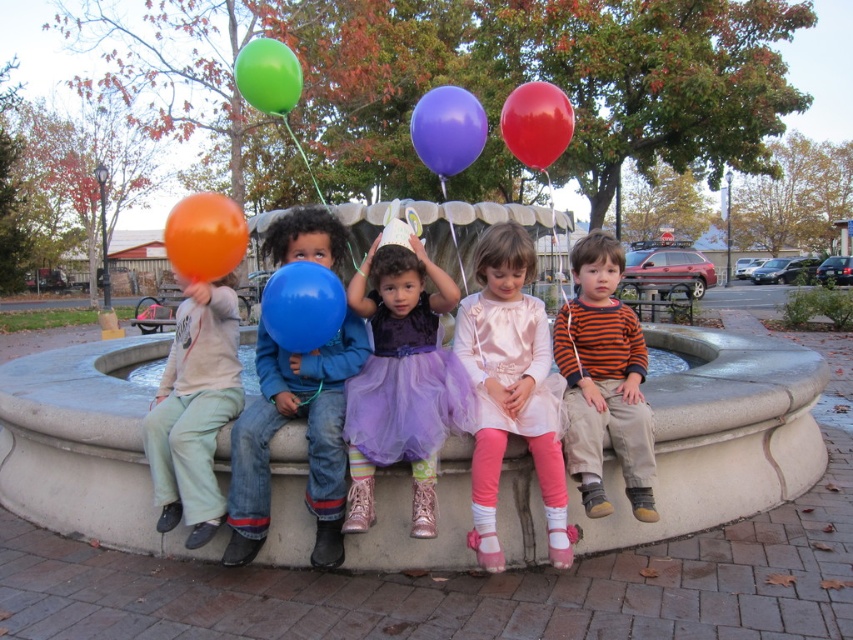
You are a photographer standing in front of the fountain. You want to take a photo of the orange rubber balloon at left and the red rubber balloon at center. Based on their positions, which balloon should appear higher in the photo?

The orange rubber balloon at left should appear higher in the photo because it is located above the red rubber balloon at center.

You are a photographer trying to capture a photo of the orange rubber balloon at left and the red rubber balloon at center. If you want to ensure both balloons are in focus, which balloon should you adjust your camera focus on first?

The orange rubber balloon at left is larger than the red rubber balloon at center, so you should focus on the orange rubber balloon at left first to ensure proper focus on both.